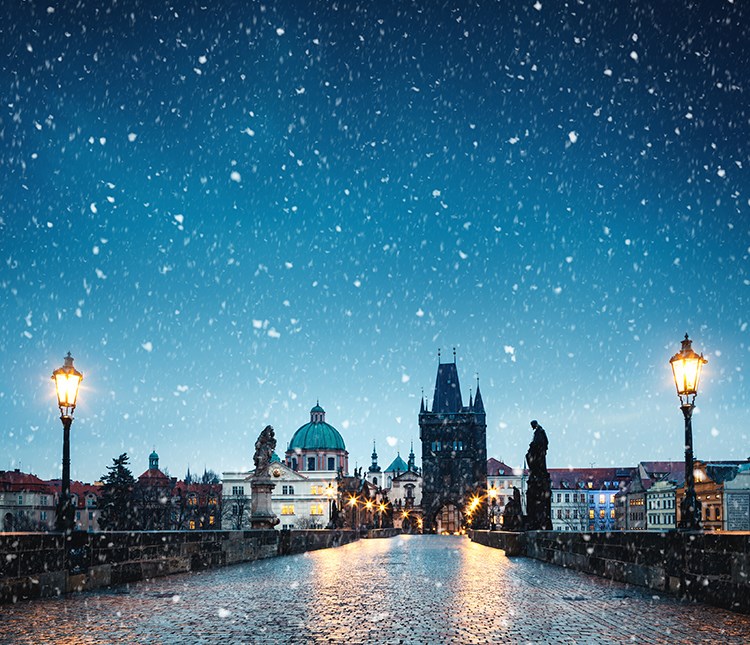
The width and height of the screenshot is (750, 645). Identify the location of lamp. (70, 387), (352, 502), (367, 504), (384, 506), (402, 513), (478, 502), (472, 508), (466, 509), (490, 493), (686, 369).